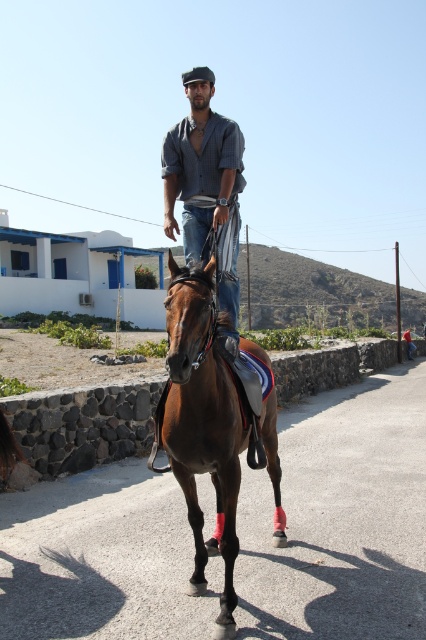
Between glossy brown horse at center and matte blue shirt at center, which one has less height?

Standing shorter between the two is glossy brown horse at center.

Is point (267, 362) farther from viewer compared to point (189, 115)?

No, (267, 362) is closer to viewer.

Where is `glossy brown horse at center`? This screenshot has height=640, width=426. glossy brown horse at center is located at coordinates (201, 422).